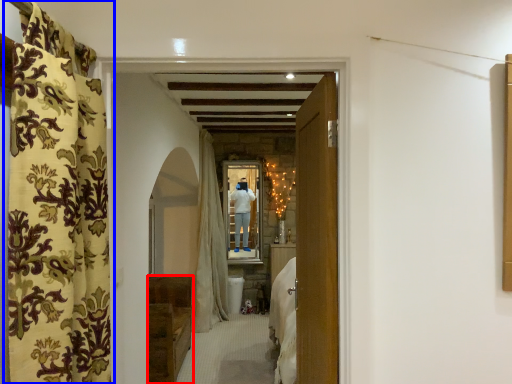
Question: Which object appears closest to the camera in this image, furniture (highlighted by a red box) or curtain (highlighted by a blue box)?

Choices:
 (A) furniture
 (B) curtain

Answer: (B)